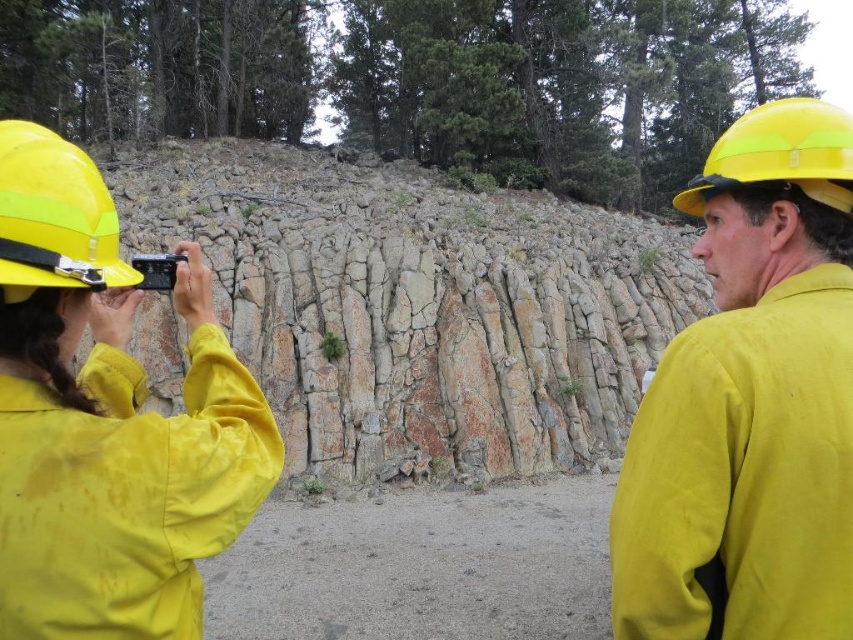
Question: Based on their relative distances, which object is nearer to the yellow matte helmet at upper right?

Choices:
 (A) yellow hard hat at left
 (B) yellow matte hard hat at left
 (C) yellow matte hard hat at upper right

Answer: (B)

Question: Does yellow matte hard hat at left have a smaller size compared to yellow hard hat at left?

Choices:
 (A) yes
 (B) no

Answer: (B)

Question: Is yellow hard hat at left behind yellow matte helmet at upper right?

Choices:
 (A) no
 (B) yes

Answer: (A)

Question: Where is yellow matte hard hat at upper right located in relation to yellow hard hat at left in the image?

Choices:
 (A) below
 (B) above

Answer: (B)

Question: Which object is closer to the camera taking this photo?

Choices:
 (A) yellow hard hat at left
 (B) yellow matte helmet at upper right
 (C) yellow matte hard hat at upper right
 (D) yellow matte hard hat at left

Answer: (D)

Question: Which point appears farthest from the camera in this image?

Choices:
 (A) (756, 195)
 (B) (68, 284)

Answer: (A)